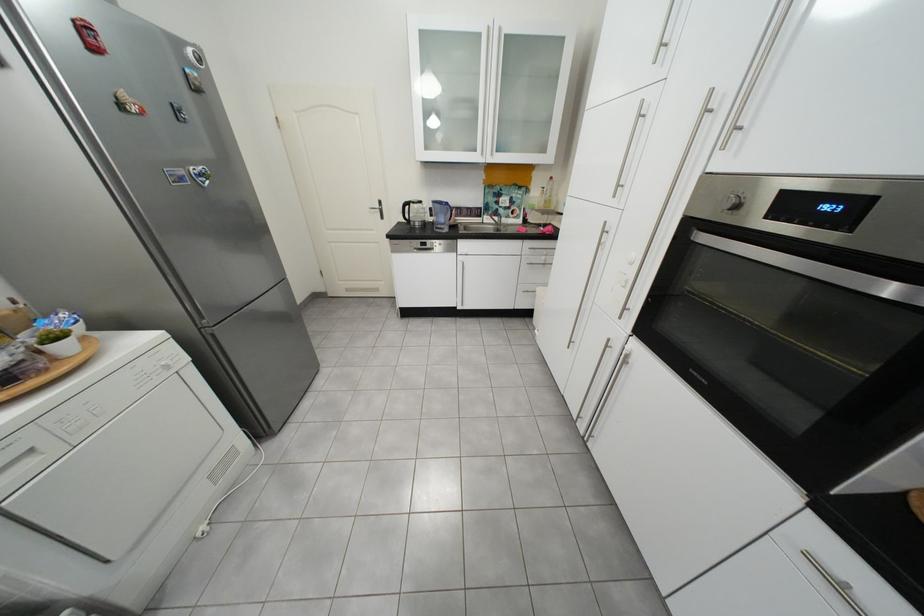
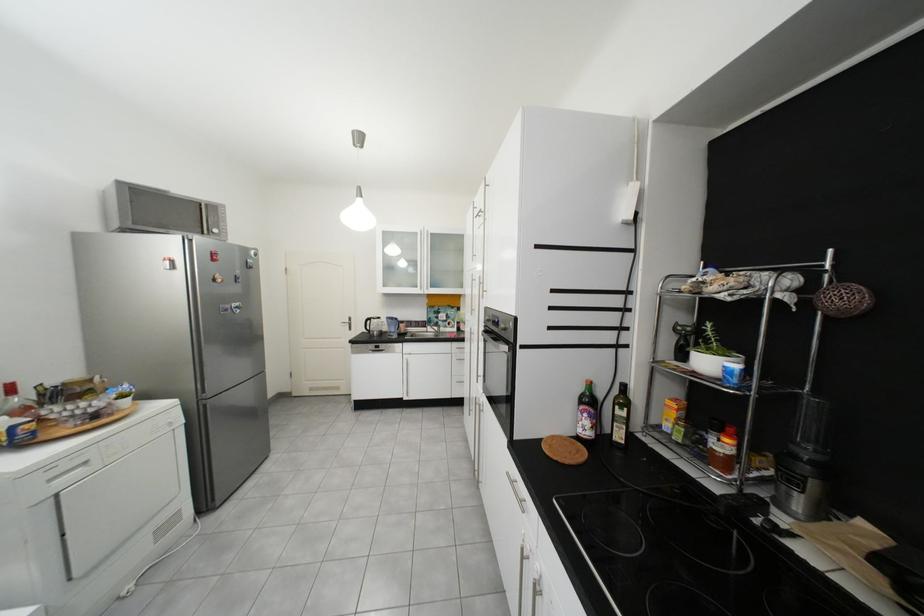
In the second image, find the point that corresponds to pixel 615 233 in the first image.

(482, 334)